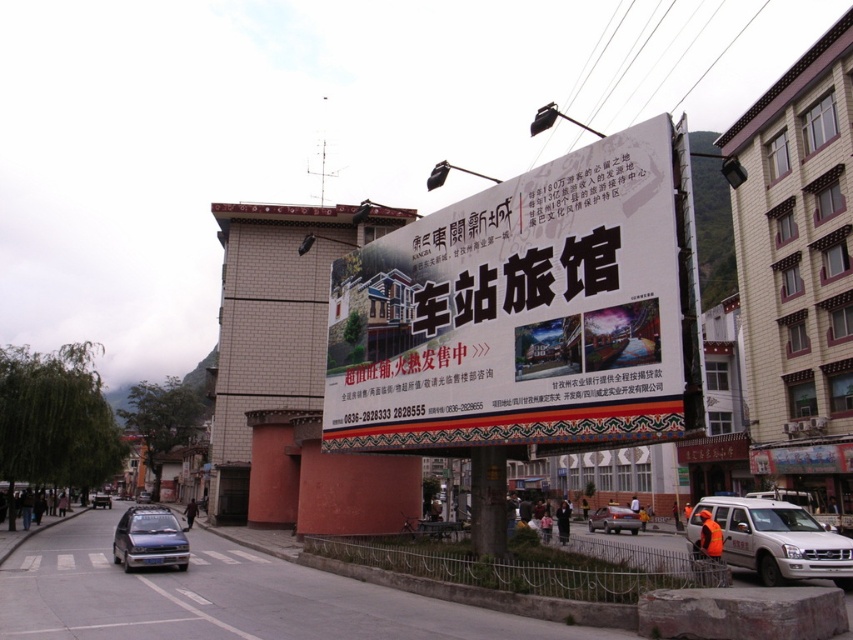
Question: Among these objects, which one is nearest to the camera?

Choices:
 (A) silver metallic sedan at center
 (B) white matte van at lower right
 (C) white paper billboard at center
 (D) blue metallic car at center

Answer: (C)

Question: Based on their relative distances, which object is nearer to the silver metallic sedan at center?

Choices:
 (A) blue metallic car at center
 (B) metallic blue sedan at lower left
 (C) white matte van at lower right
 (D) white paper billboard at center

Answer: (C)

Question: Which point is closer to the camera taking this photo?

Choices:
 (A) (x=628, y=522)
 (B) (x=109, y=506)
 (C) (x=416, y=330)

Answer: (C)

Question: Is white paper billboard at center further to the viewer compared to metallic blue sedan at lower left?

Choices:
 (A) yes
 (B) no

Answer: (B)

Question: Can you confirm if silver metallic sedan at center is positioned to the left of blue metallic car at center?

Choices:
 (A) no
 (B) yes

Answer: (A)

Question: Does metallic blue sedan at lower left have a smaller size compared to silver metallic sedan at center?

Choices:
 (A) yes
 (B) no

Answer: (B)